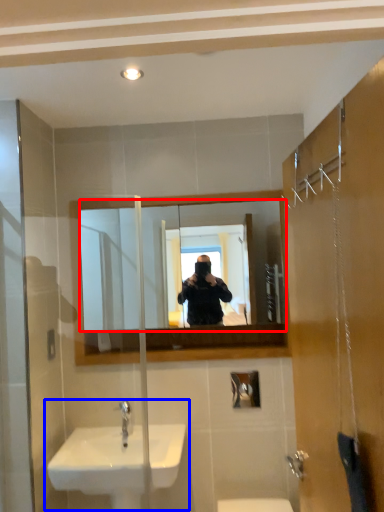
Question: Which object is further to the camera taking this photo, mirror (highlighted by a red box) or sink (highlighted by a blue box)?

Choices:
 (A) mirror
 (B) sink

Answer: (A)